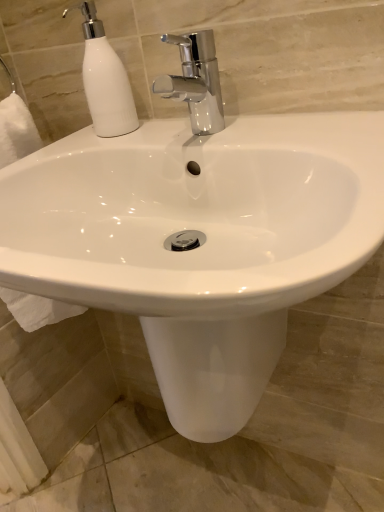
The height and width of the screenshot is (512, 384). Identify the location of vacant region to the left of white matte soap dispenser at upper left. (63, 144).